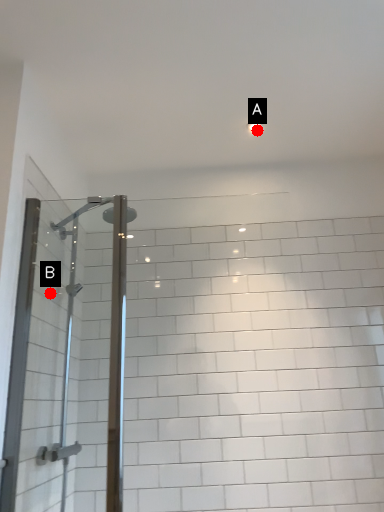
Question: Two points are circled on the image, labeled by A and B beside each circle. Which point appears closest to the camera in this image?

Choices:
 (A) A is closer
 (B) B is closer

Answer: (B)